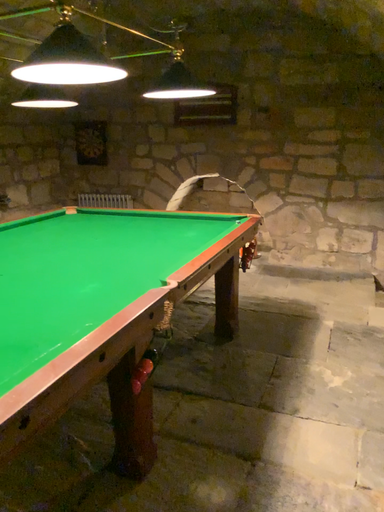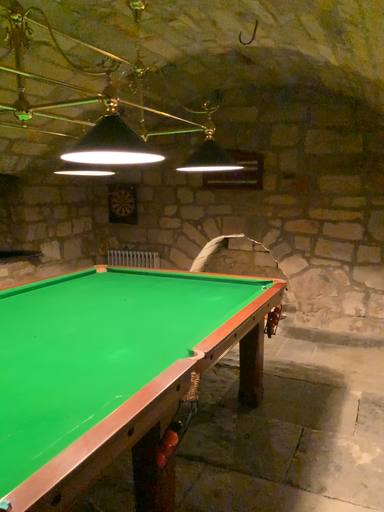
Question: Which way did the camera rotate in the video?

Choices:
 (A) rotated downward
 (B) rotated upward

Answer: (B)